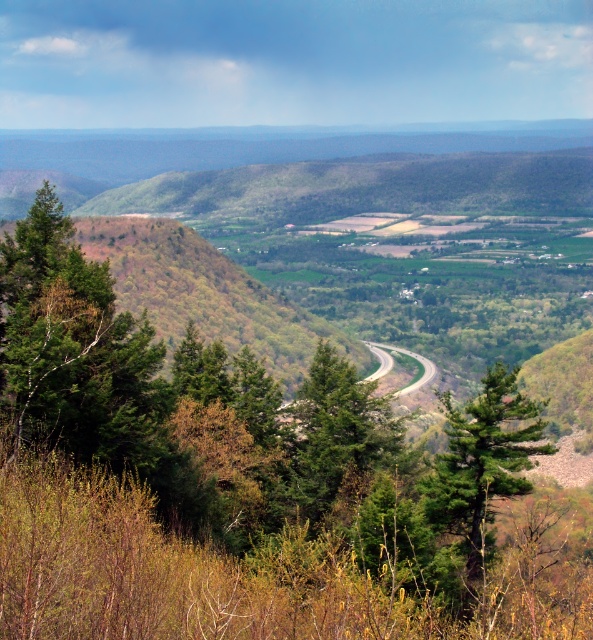
You are a hiker trying to decide which tree to rest under. You see a green leafy tree at center and a green matte tree at center. Which tree has a larger canopy to provide more shade?

The green leafy tree at center might be wider than green matte tree at center, so it likely has a larger canopy and can provide more shade.

You are a hiker planning to take a photo of the valley. You want to include both the green matte tree at center and the green textured tree at center in your shot. Which tree should you focus on to ensure both are visible in the frame?

You should focus on the green textured tree at center because it occupies more space and will be easier to frame alongside the smaller green matte tree at center.

You are standing at the highest point of the valley and looking down. You see two trees at the center of the valley, a green leafy tree at center and a green matte tree at center. Which one is more to the left?

The green leafy tree at center is positioned on the left side of green matte tree at center, so the green leafy tree at center is more to the left.